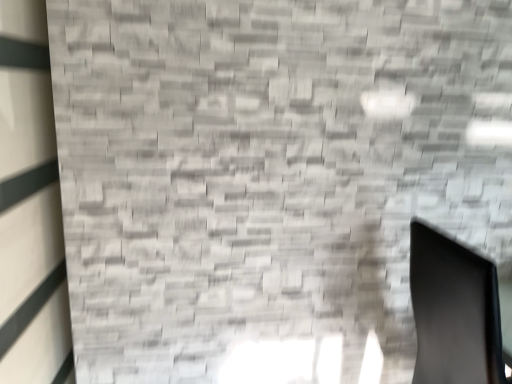
Question: In terms of height, does matte gray brick wall at left look taller or shorter compared to black matte swivel chair at lower right?

Choices:
 (A) short
 (B) tall

Answer: (B)

Question: In the image, is matte gray brick wall at left positioned in front of or behind black matte swivel chair at lower right?

Choices:
 (A) front
 (B) behind

Answer: (A)

Question: From a real-world perspective, is matte gray brick wall at left above or below black matte swivel chair at lower right?

Choices:
 (A) above
 (B) below

Answer: (A)

Question: Considering the positions of point (440, 365) and point (49, 337), is point (440, 365) closer or farther from the camera than point (49, 337)?

Choices:
 (A) farther
 (B) closer

Answer: (A)

Question: Choose the correct answer: Is black matte swivel chair at lower right inside matte gray brick wall at left or outside it?

Choices:
 (A) inside
 (B) outside

Answer: (B)

Question: Relative to matte gray brick wall at left, is black matte swivel chair at lower right in front or behind?

Choices:
 (A) front
 (B) behind

Answer: (B)

Question: Is black matte swivel chair at lower right wider or thinner than matte gray brick wall at left?

Choices:
 (A) wide
 (B) thin

Answer: (A)